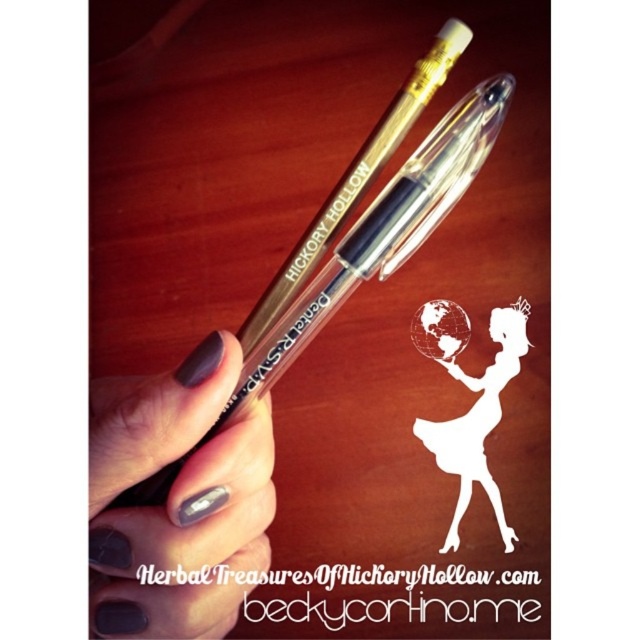
In the scene shown: Can you confirm if clear plastic pen at center is taller than white paper silhouette at center?

Yes, clear plastic pen at center is taller than white paper silhouette at center.

This screenshot has height=640, width=640. I want to click on clear plastic pen at center, so click(364, 252).

Is point (252, 548) in front of point (500, 120)?

No, (252, 548) is behind (500, 120).

Which is behind, point (161, 548) or point (412, 212)?

Positioned behind is point (412, 212).

At what (x,y) coordinates should I click in order to perform the action: click on matte gray nail polish at lower left. Please return your answer as a coordinate pair (x, y). The image size is (640, 640). Looking at the image, I should click on (177, 499).

Is point (211, 506) behind point (499, 344)?

No, it is in front of (499, 344).

Does matte gray nail polish at lower left have a lesser height compared to white paper silhouette at center?

No, matte gray nail polish at lower left is not shorter than white paper silhouette at center.

In order to click on matte gray nail polish at lower left in this screenshot , I will do `click(177, 499)`.